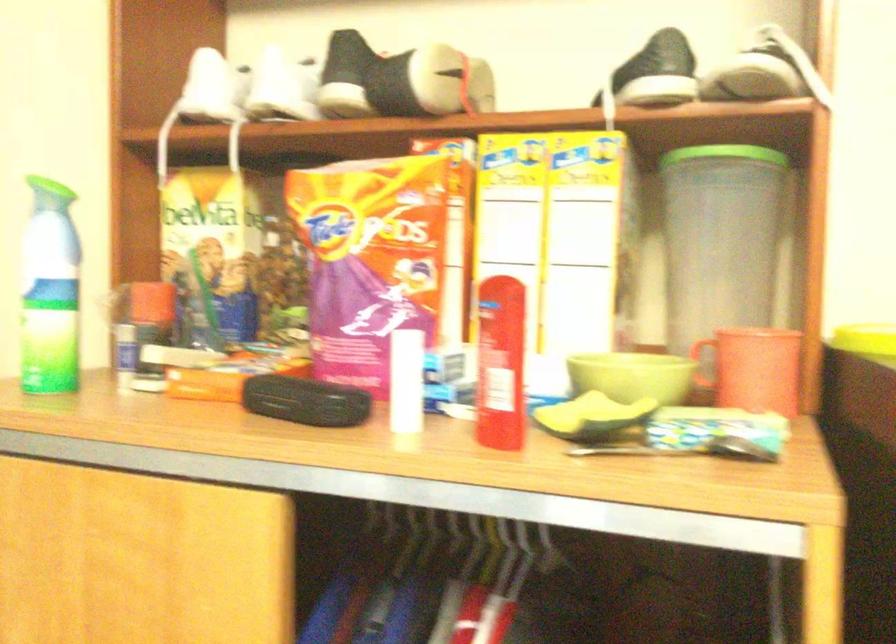
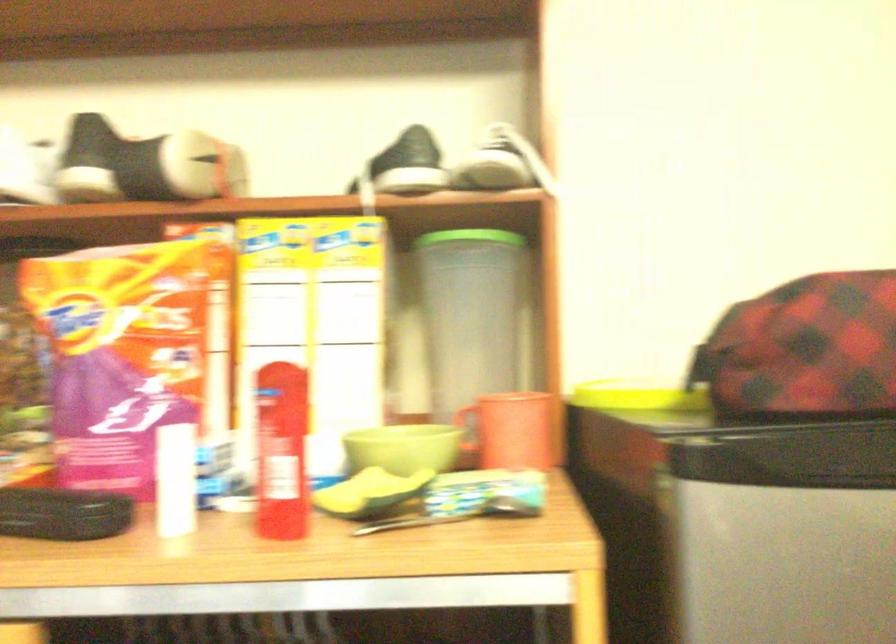
Question: The images are taken continuously from a first-person perspective. In which direction is your viewpoint rotating?

Choices:
 (A) Left
 (B) Right
 (C) Up
 (D) Down

Answer: (B)